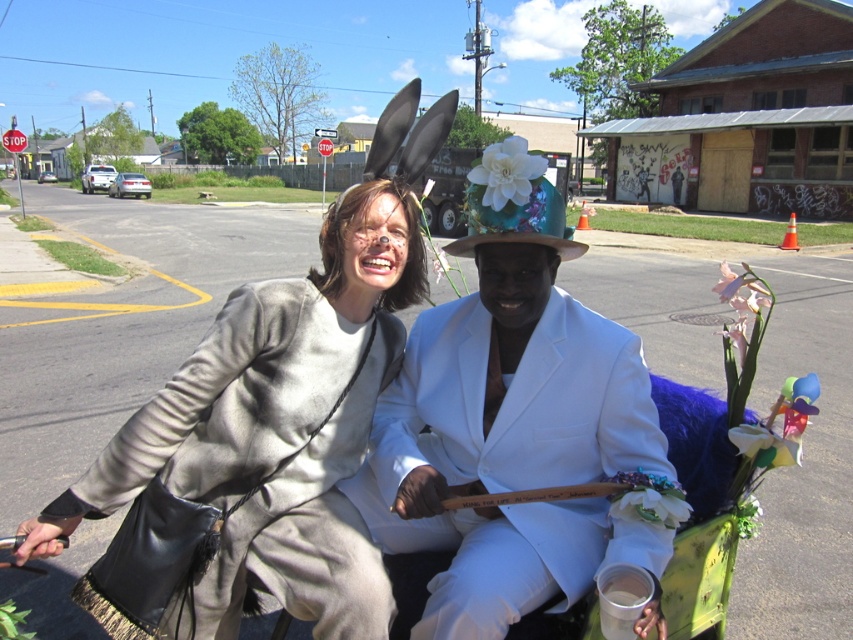
Question: Which object is the farthest from the floral fabric hat at center?

Choices:
 (A) matte gray coat at center
 (B) white satin suit at center

Answer: (A)

Question: Is matte gray coat at center further to the viewer compared to floral fabric hat at center?

Choices:
 (A) no
 (B) yes

Answer: (A)

Question: Where is white satin suit at center located in relation to matte gray coat at center in the image?

Choices:
 (A) left
 (B) right

Answer: (B)

Question: Is white satin suit at center to the left of matte gray coat at center from the viewer's perspective?

Choices:
 (A) yes
 (B) no

Answer: (B)

Question: Which object is positioned farthest from the white satin suit at center?

Choices:
 (A) matte gray coat at center
 (B) floral fabric hat at center

Answer: (B)

Question: Estimate the real-world distances between objects in this image. Which object is closer to the floral fabric hat at center?

Choices:
 (A) matte gray coat at center
 (B) white satin suit at center

Answer: (B)